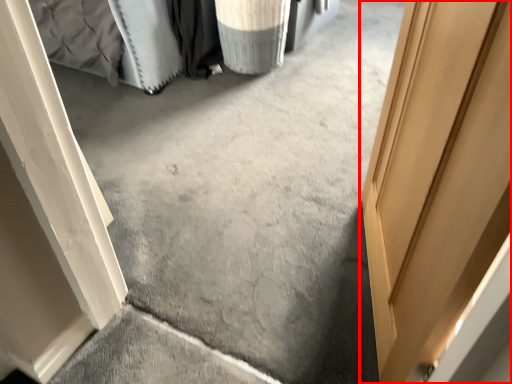
Question: From the image's perspective, where is door (annotated by the red box) located relative to laundry basket?

Choices:
 (A) above
 (B) below

Answer: (B)